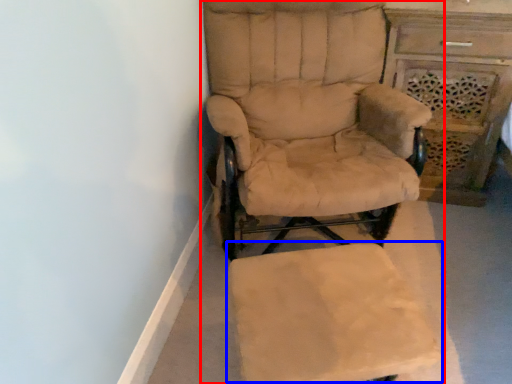
Question: Which of the following is the farthest to the observer, chair (highlighted by a red box) or swivel chair (highlighted by a blue box)?

Choices:
 (A) chair
 (B) swivel chair

Answer: (A)